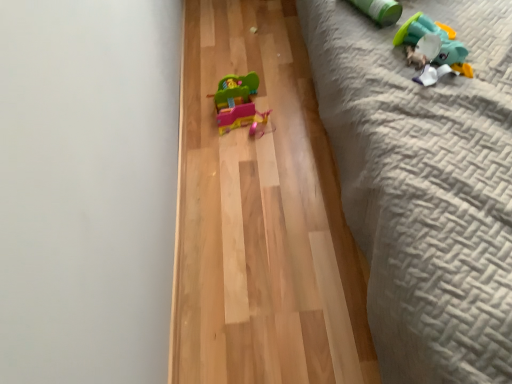
You are a GUI agent. You are given a task and a screenshot of the screen. Output one action in this format:
    pyautogui.click(x=<x>, y=<y>)
    Task: Click on the free space on the front side of matte plastic toy at center, acting as the first toy starting from the left
    The height and width of the screenshot is (384, 512).
    Given the screenshot: What is the action you would take?
    pyautogui.click(x=248, y=160)